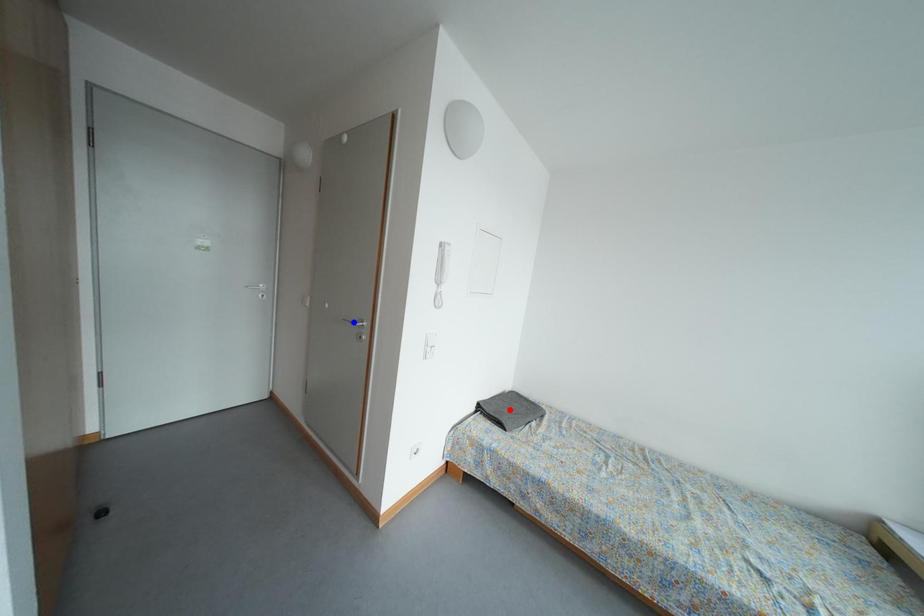
Question: In the image, two points are highlighted. Which point is nearer to the camera? Reply with the corresponding letter.

Choices:
 (A) blue point
 (B) red point

Answer: (A)